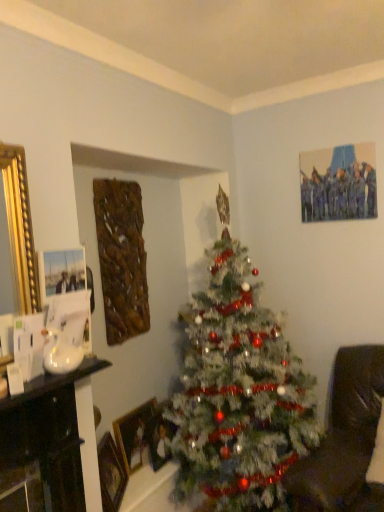
Question: From the image's perspective, is brown leather rocking chair at lower right positioned above or below white frosted christmas tree at center?

Choices:
 (A) above
 (B) below

Answer: (B)

Question: Based on their sizes in the image, would you say brown leather rocking chair at lower right is bigger or smaller than white frosted christmas tree at center?

Choices:
 (A) small
 (B) big

Answer: (A)

Question: Considering the real-world distances, which object is farthest from the white frosted christmas tree at center?

Choices:
 (A) wooden picture frame at center, which appears as the first picture frame when viewed from the back
 (B) wooden picture frame at lower left, the 3th picture frame viewed from the back
 (C) brown leather rocking chair at lower right
 (D) wooden picture frame at lower left, marked as the 2th picture frame in a front-to-back arrangement
 (E) white glossy sink at left

Answer: (E)

Question: Estimate the real-world distances between objects in this image. Which object is closer to the brown leather rocking chair at lower right?

Choices:
 (A) wooden picture frame at lower left, marked as the 2th picture frame in a front-to-back arrangement
 (B) wooden picture frame at lower left, the 3th picture frame viewed from the back
 (C) white glossy sink at left
 (D) wooden picture frame at center, the 3th picture frame positioned from the front
 (E) white frosted christmas tree at center

Answer: (E)